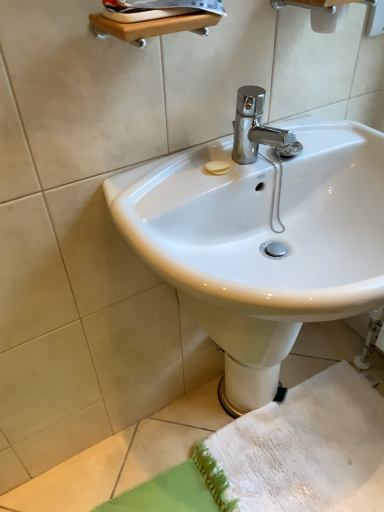
What are the coordinates of `white glossy sink at center` in the screenshot? It's located at (263, 242).

Describe the element at coordinates (244, 353) in the screenshot. I see `white glossy bidet at lower center` at that location.

Image resolution: width=384 pixels, height=512 pixels. Identify the location of white glossy bidet at lower center. (244, 353).

The image size is (384, 512). Find the location of `white textured towel at lower right`. white textured towel at lower right is located at coordinates (302, 450).

The width and height of the screenshot is (384, 512). What do you see at coordinates (302, 450) in the screenshot?
I see `white textured towel at lower right` at bounding box center [302, 450].

Locate an element on the screen. This screenshot has width=384, height=512. white glossy sink at center is located at coordinates (263, 242).

Locate an element on the screen. Image resolution: width=384 pixels, height=512 pixels. bidet located underneath the white glossy sink at center (from a real-world perspective) is located at coordinates (244, 353).

Is white glossy sink at center bigger or smaller than white glossy bidet at lower center?

white glossy sink at center is bigger than white glossy bidet at lower center.

Is white glossy sink at center in contact with white glossy bidet at lower center?

They are not placed beside each other.

Who is taller, white glossy sink at center or white glossy bidet at lower center?

With more height is white glossy sink at center.

Is white glossy sink at center positioned before white textured towel at lower right?

Yes, white glossy sink at center is closer to the camera.

From a real-world perspective, does white glossy sink at center sit lower than white textured towel at lower right?

No, from a real-world perspective, white glossy sink at center is not beneath white textured towel at lower right.

Identify the location of beach towel lying below the white glossy sink at center (from the image's perspective). (302, 450).

From the picture: In terms of height, does white glossy sink at center look taller or shorter compared to white textured towel at lower right?

Clearly, white glossy sink at center is taller compared to white textured towel at lower right.

Where is `bidet on the left of white glossy sink at center`? bidet on the left of white glossy sink at center is located at coordinates click(x=244, y=353).

What's the angular difference between white glossy bidet at lower center and white glossy sink at center's facing directions?

The angular difference between white glossy bidet at lower center and white glossy sink at center is 3.81 degrees.

From the picture: From the image's perspective, is white glossy bidet at lower center located above or below white glossy sink at center?

Based on their image positions, white glossy bidet at lower center is located beneath white glossy sink at center.

Which of these two, white glossy bidet at lower center or white glossy sink at center, is bigger?

With larger size is white glossy sink at center.

Is white textured towel at lower right shorter than white glossy bidet at lower center?

Yes, white textured towel at lower right is shorter than white glossy bidet at lower center.

Does white textured towel at lower right have a lesser width compared to white glossy bidet at lower center?

In fact, white textured towel at lower right might be wider than white glossy bidet at lower center.

From a real-world perspective, is white textured towel at lower right positioned over white glossy bidet at lower center based on gravity?

No, from a real-world perspective, white textured towel at lower right is not above white glossy bidet at lower center.

Is white textured towel at lower right inside the boundaries of white glossy sink at center, or outside?

white textured towel at lower right is located beyond the bounds of white glossy sink at center.

From the image's perspective, which object appears higher, white textured towel at lower right or white glossy sink at center?

white glossy sink at center, from the image's perspective.

Is point (224, 453) closer or farther from the camera than point (245, 395)?

Point (224, 453) appears to be closer to the viewer than point (245, 395).

From a real-world perspective, which object stands above the other?

white glossy sink at center is physically above.

Looking at their sizes, would you say white glossy bidet at lower center is wider or thinner than white textured towel at lower right?

Clearly, white glossy bidet at lower center has less width compared to white textured towel at lower right.

Looking at this image, in the image, is white glossy bidet at lower center positioned in front of or behind white textured towel at lower right?

white glossy bidet at lower center is behind white textured towel at lower right.

Is white glossy bidet at lower center not near white textured towel at lower right?

white glossy bidet at lower center is near white textured towel at lower right, not far away.

Between white glossy bidet at lower center and white textured towel at lower right, which one has less height?

white textured towel at lower right is shorter.

In the image, there is a white glossy sink at center. Where is `bidet below it (from the image's perspective)`? This screenshot has width=384, height=512. bidet below it (from the image's perspective) is located at coordinates tap(244, 353).

This screenshot has height=512, width=384. Identify the location of beach towel on the right of white glossy sink at center. click(x=302, y=450).

When comparing their distances from white glossy sink at center, does white glossy bidet at lower center or white textured towel at lower right seem closer?

white glossy bidet at lower center is positioned closer to the anchor white glossy sink at center.

Looking at the image, which one is located closer to white glossy bidet at lower center, white glossy sink at center or white textured towel at lower right?

white glossy sink at center.

Estimate the real-world distances between objects in this image. Which object is closer to white glossy sink at center, white textured towel at lower right or white glossy bidet at lower center?

white glossy bidet at lower center is positioned closer to the anchor white glossy sink at center.

When comparing their distances from white textured towel at lower right, does white glossy bidet at lower center or white glossy sink at center seem further?

white glossy sink at center is positioned further to the anchor white textured towel at lower right.

Considering their positions, is white glossy sink at center positioned further to white textured towel at lower right than white glossy bidet at lower center?

Based on the image, white glossy sink at center appears to be further to white textured towel at lower right.

When comparing their distances from white glossy bidet at lower center, does white textured towel at lower right or white glossy sink at center seem further?

Among the two, white textured towel at lower right is located further to white glossy bidet at lower center.

Find the location of a particular element. This screenshot has height=512, width=384. beach towel located between white glossy sink at center and white glossy bidet at lower center in the depth direction is located at coordinates (x=302, y=450).